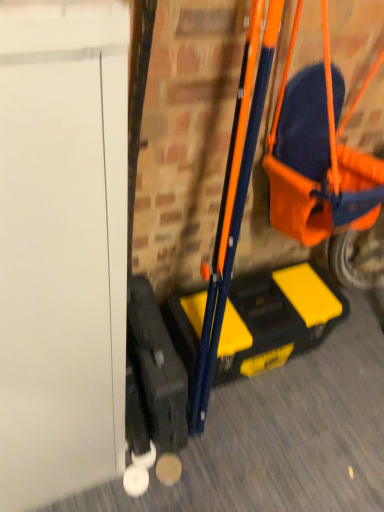
This screenshot has width=384, height=512. What are the coordinates of `orange fabric baby carriage at right` in the screenshot? It's located at (321, 170).

Image resolution: width=384 pixels, height=512 pixels. Describe the element at coordinates (321, 170) in the screenshot. I see `orange fabric baby carriage at right` at that location.

Identify the location of orange fabric baby carriage at right. The image size is (384, 512). (321, 170).